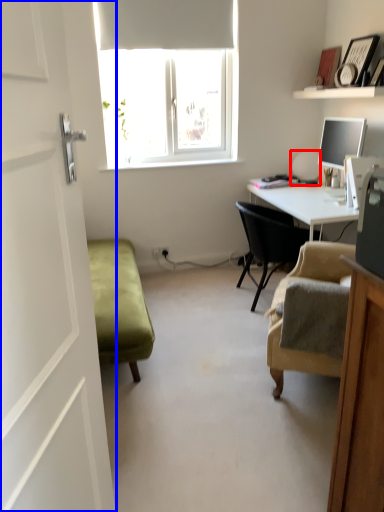
Question: Which object appears farthest to the camera in this image, table lamp (highlighted by a red box) or screen door (highlighted by a blue box)?

Choices:
 (A) table lamp
 (B) screen door

Answer: (A)